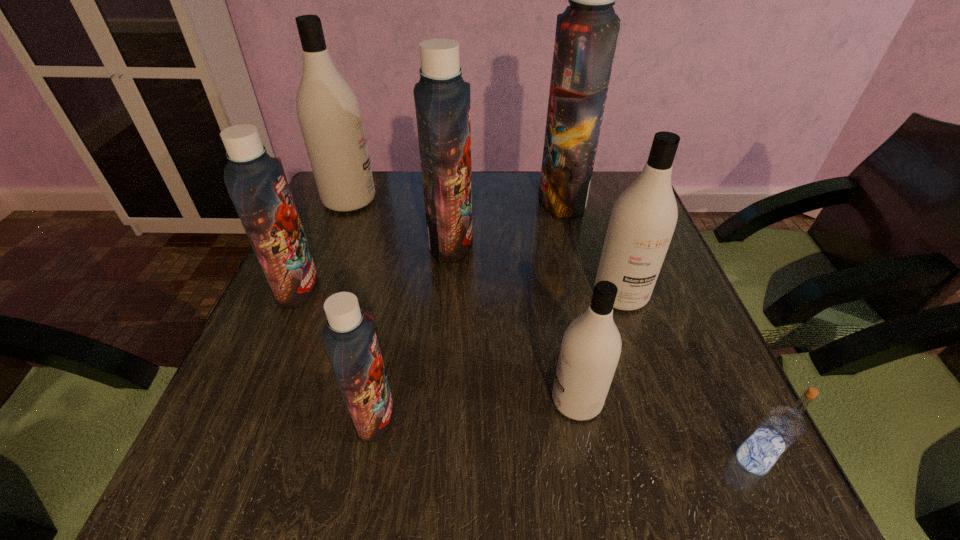
I want to click on free space that is in between the second blue shampoo from right to left and the tallest shampoo, so click(507, 220).

Identify the location of free space that is in between the tallest shampoo and the second biggest white shampoo. (591, 247).

Identify the location of empty space between the smallest white shampoo and the farthest white shampoo. (463, 300).

The width and height of the screenshot is (960, 540). I want to click on empty space between the second nearest white shampoo and the tallest shampoo, so click(591, 247).

Identify which object is the second closest to the biggest blue shampoo. Please provide its 2D coordinates. Your answer should be formatted as a tuple, i.e. [(x, y)], where the tuple contains the x and y coordinates of a point satisfying the conditions above.

[(643, 219)]

Point out which object is positioned as the third nearest to the rightmost object. Please provide its 2D coordinates. Your answer should be formatted as a tuple, i.e. [(x, y)], where the tuple contains the x and y coordinates of a point satisfying the conditions above.

[(350, 340)]

You are a GUI agent. You are given a task and a screenshot of the screen. Output one action in this format:
    pyautogui.click(x=<x>, y=<y>)
    Task: Click on the sixth closest shampoo to the second smallest white shampoo
    The width and height of the screenshot is (960, 540).
    Given the screenshot: What is the action you would take?
    pyautogui.click(x=257, y=184)

The image size is (960, 540). In order to click on shampoo identified as the seventh closest to the rightmost object in this screenshot , I will do `click(329, 114)`.

Point out which blue shampoo is positioned as the nearest to the tallest object. Please provide its 2D coordinates. Your answer should be formatted as a tuple, i.e. [(x, y)], where the tuple contains the x and y coordinates of a point satisfying the conditions above.

[(442, 98)]

Identify which blue shampoo is the closest to the tallest object. Please provide its 2D coordinates. Your answer should be formatted as a tuple, i.e. [(x, y)], where the tuple contains the x and y coordinates of a point satisfying the conditions above.

[(442, 98)]